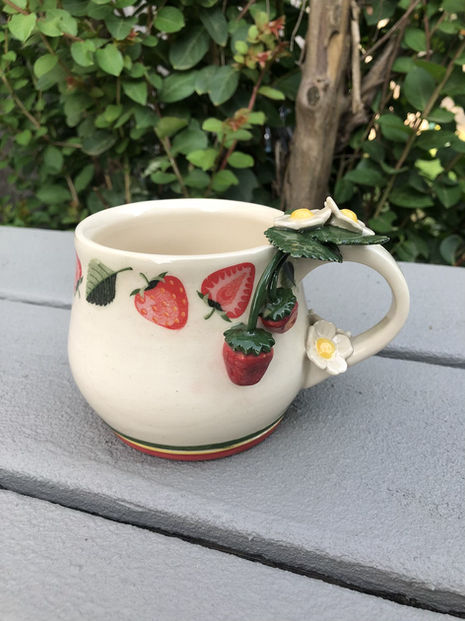
In order to click on handle in this screenshot , I will do `click(399, 301)`.